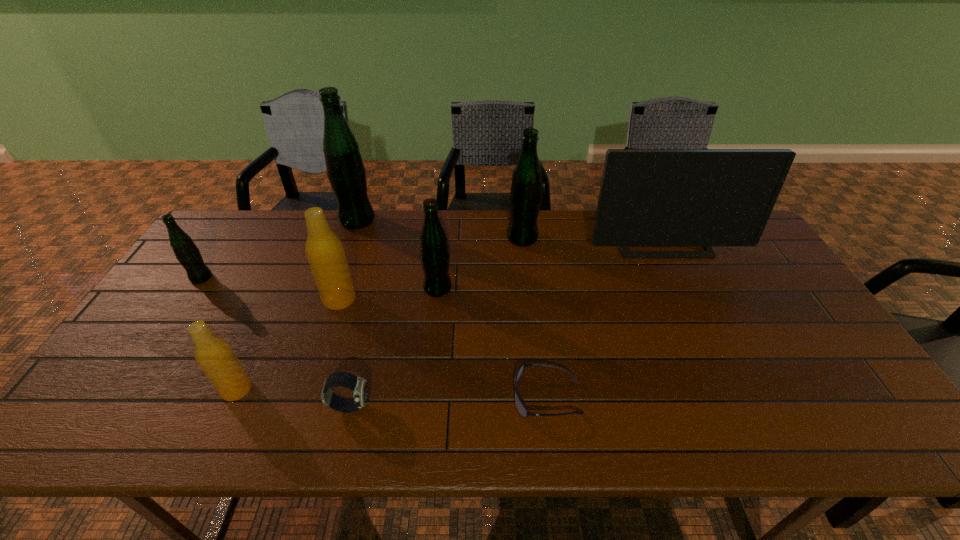
Choose which beer bottle is the fourth nearest neighbor to the rightmost green beer bottle. Please provide its 2D coordinates. Your answer should be formatted as a tuple, i.e. [(x, y)], where the tuple contains the x and y coordinates of a point satisfying the conditions above.

[(214, 355)]

I want to click on green beer bottle object that ranks as the second closest to the right tan beer bottle, so click(346, 172).

Locate which green beer bottle ranks third in proximity to the fifth object from left to right. Please provide its 2D coordinates. Your answer should be formatted as a tuple, i.e. [(x, y)], where the tuple contains the x and y coordinates of a point satisfying the conditions above.

[(346, 172)]

Locate an element on the screen. This screenshot has width=960, height=540. vacant space that satisfies the following two spatial constraints: 1. on the front side of the nearer tan beer bottle; 2. on the left side of the leftmost green beer bottle is located at coordinates (127, 389).

This screenshot has height=540, width=960. In order to click on vacant space that satisfies the following two spatial constraints: 1. on the screen side of the black computer monitor; 2. on the lenses of the shortest object in this screenshot , I will do pyautogui.click(x=736, y=397).

Identify the location of free spot that satisfies the following two spatial constraints: 1. on the front side of the tallest beer bottle; 2. on the left side of the sixth object from left to right. [x=334, y=288].